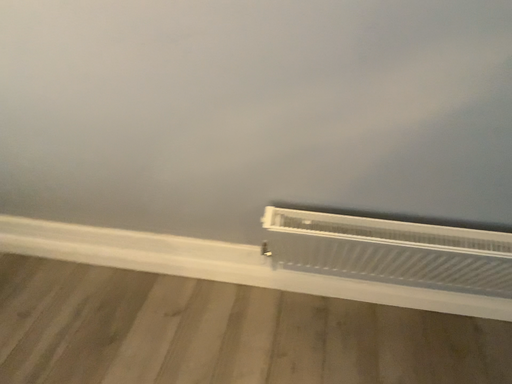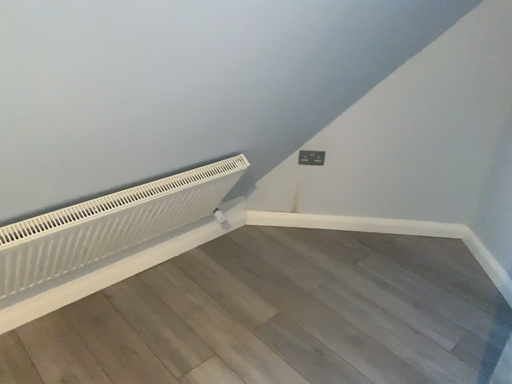
Question: How did the camera likely rotate when shooting the video?

Choices:
 (A) rotated downward
 (B) rotated upward

Answer: (B)